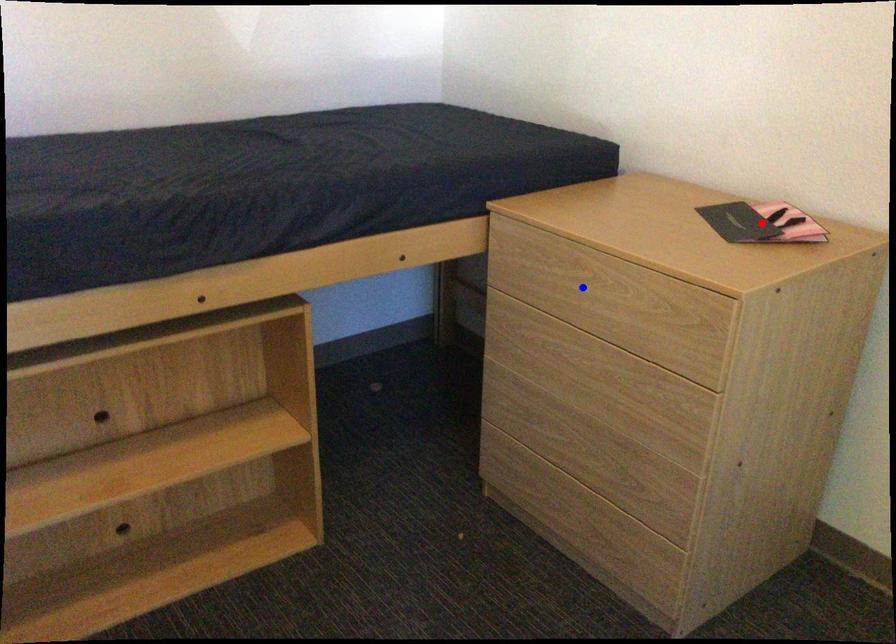
Question: Which of the two points in the image is closer to the camera?

Choices:
 (A) Blue point is closer.
 (B) Red point is closer.

Answer: (B)